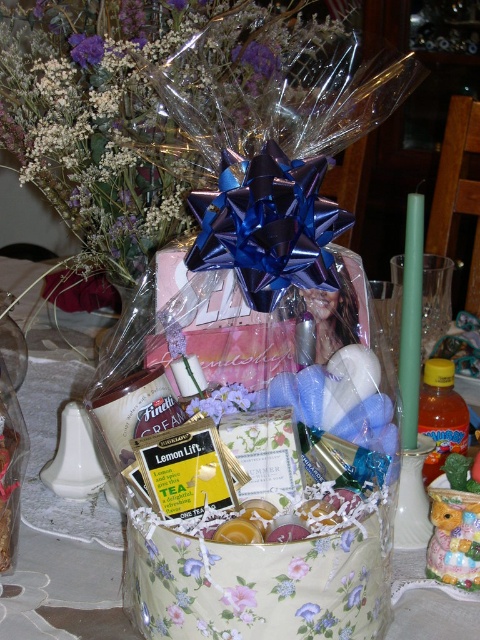
Can you confirm if purple floral bouquet at upper left is positioned above pink fabric flower at center?

Correct, purple floral bouquet at upper left is located above pink fabric flower at center.

From the picture: Between purple floral bouquet at upper left and pink fabric flower at center, which one has less height?

pink fabric flower at center is shorter.

Does point (97, 56) come behind point (227, 596)?

Yes, point (97, 56) is behind point (227, 596).

Where is `purple floral bouquet at upper left`? purple floral bouquet at upper left is located at coordinates point(85,49).

Between floral-patterned fabric basket at center and floral paper at lower center, which one has less height?

With less height is floral paper at lower center.

From the picture: Is floral-patterned fabric basket at center above floral paper at lower center?

Indeed, floral-patterned fabric basket at center is positioned over floral paper at lower center.

Which is in front, point (110, 570) or point (301, 561)?

Point (301, 561)

Locate an element on the screen. floral-patterned fabric basket at center is located at coordinates [74, 573].

Is translucent plastic bouquet at upper center positioned at the back of purple floral bouquet at center?

Yes, it is behind purple floral bouquet at center.

Does translucent plastic bouquet at upper center have a lesser height compared to purple floral bouquet at center?

No, translucent plastic bouquet at upper center is not shorter than purple floral bouquet at center.

What do you see at coordinates (98, 120) in the screenshot?
I see `translucent plastic bouquet at upper center` at bounding box center [98, 120].

At what (x,y) coordinates should I click in order to perform the action: click on translucent plastic bouquet at upper center. Please return your answer as a coordinate pair (x, y). This screenshot has height=640, width=480. Looking at the image, I should click on [x=98, y=120].